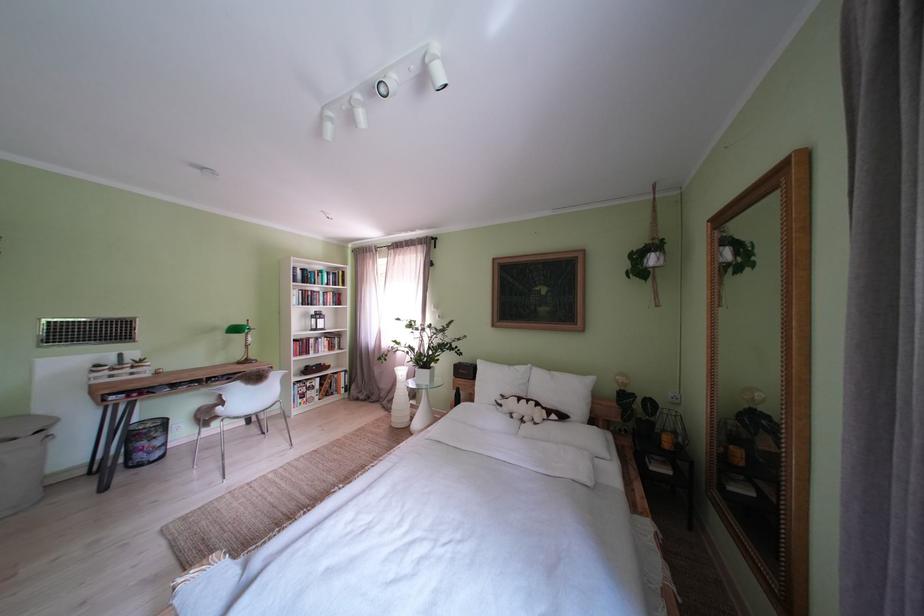
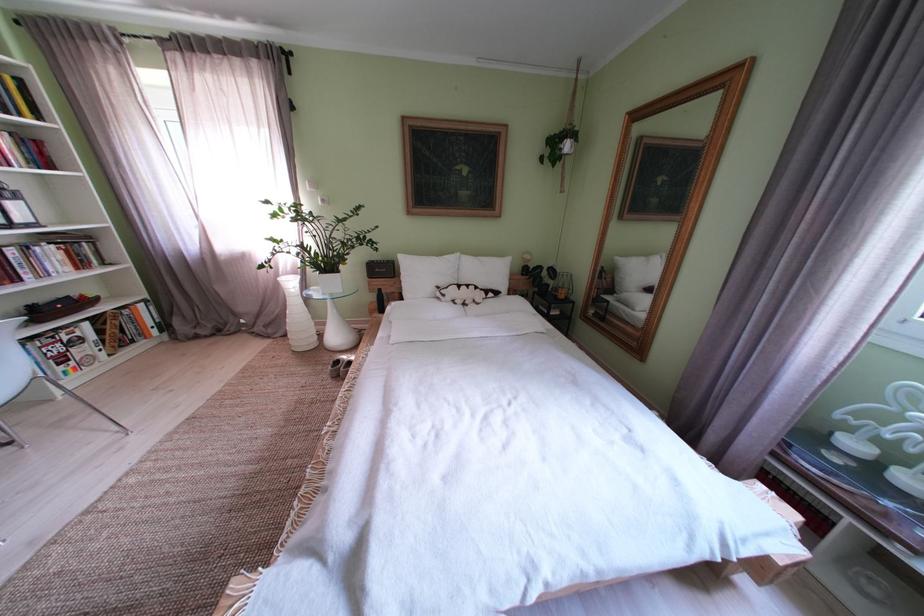
Find the pixel in the second image that matches (406,411) in the first image.

(301, 334)